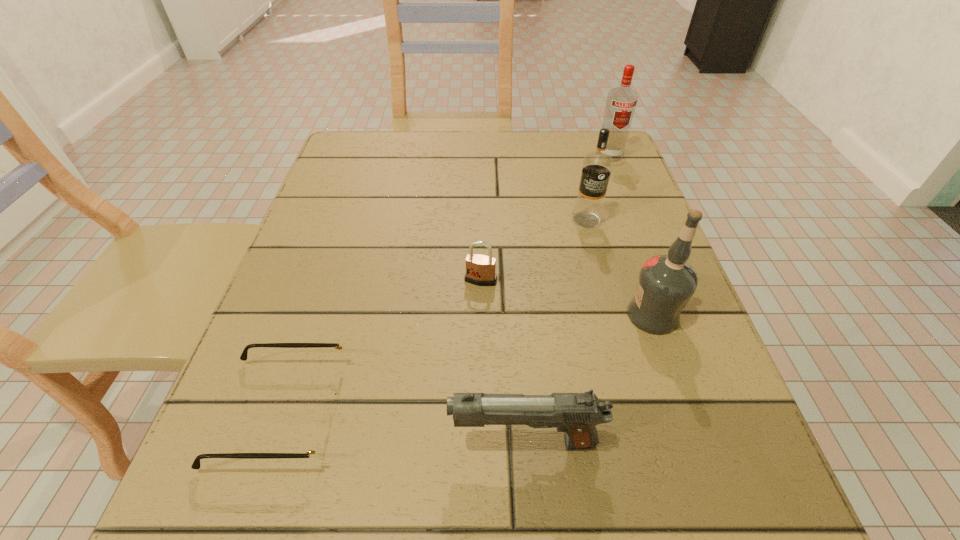
The height and width of the screenshot is (540, 960). In order to click on free region located 0.260m on the front label of the nearest vodka in this screenshot , I will do `click(469, 315)`.

You are a GUI agent. You are given a task and a screenshot of the screen. Output one action in this format:
    pyautogui.click(x=<x>, y=<y>)
    Task: Click on the free location located 0.290m on the front label of the nearest vodka
    The width and height of the screenshot is (960, 540).
    Given the screenshot: What is the action you would take?
    pyautogui.click(x=451, y=315)

Locate an element on the screen. The image size is (960, 540). vacant position located 0.110m on the label of the second farthest object is located at coordinates (599, 268).

At what (x,y) coordinates should I click in order to perform the action: click on vacant space situated in the direction the fourth tallest object is aimed. Please return your answer as a coordinate pair (x, y). Image resolution: width=960 pixels, height=540 pixels. Looking at the image, I should click on (345, 443).

Locate an element on the screen. vacant space located in the direction the fourth tallest object is aimed is located at coordinates (291, 443).

What are the coordinates of `vacant space positioned in the direction the fourth tallest object is aimed` in the screenshot? It's located at (368, 443).

Image resolution: width=960 pixels, height=540 pixels. I want to click on free space located on the front of the third farthest object, so click(x=481, y=408).

You are a GUI agent. You are given a task and a screenshot of the screen. Output one action in this format:
    pyautogui.click(x=<x>, y=<y>)
    Task: Click on the free spot located at the hinge ends of the leftmost object
    
    Given the screenshot: What is the action you would take?
    pyautogui.click(x=430, y=413)

I want to click on object that is at the far edge, so click(621, 103).

Where is `object that is at the left edge`? This screenshot has width=960, height=540. object that is at the left edge is located at coordinates (317, 452).